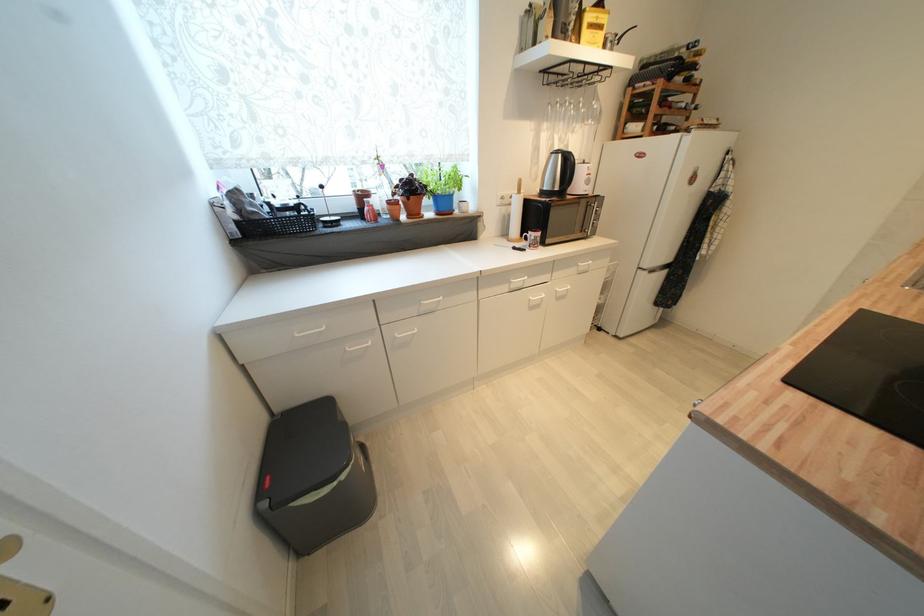
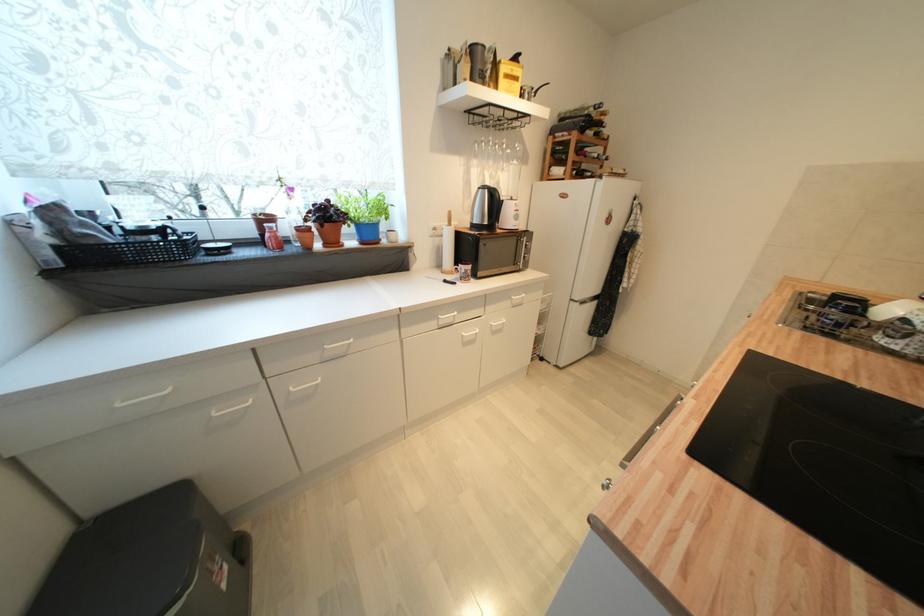
Find the pixel in the second image that matches (415,219) in the first image.

(331, 246)